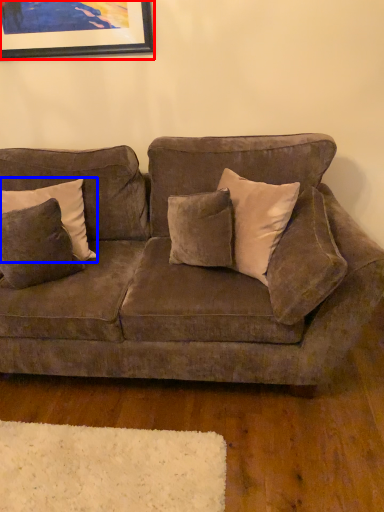
Question: Which object appears farthest to the camera in this image, picture frame (highlighted by a red box) or pillow (highlighted by a blue box)?

Choices:
 (A) picture frame
 (B) pillow

Answer: (A)